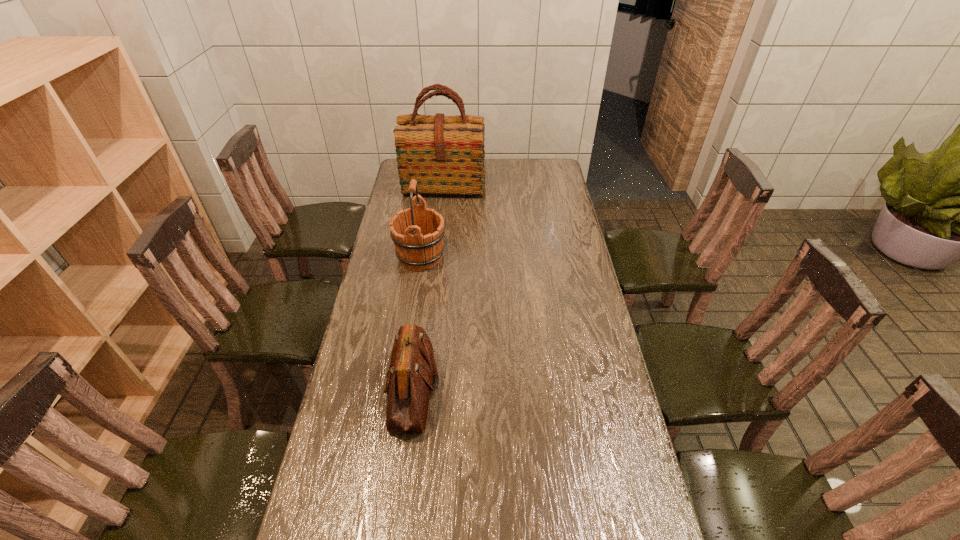
Where is `the farthest object`? the farthest object is located at coordinates (445, 154).

In order to click on the tallest object in this screenshot , I will do `click(445, 154)`.

Locate an element on the screen. the second tallest object is located at coordinates (417, 232).

Where is `the second farthest object`? the second farthest object is located at coordinates (417, 232).

Find the location of a particular element. The height and width of the screenshot is (540, 960). shoulder bag is located at coordinates (412, 368).

The image size is (960, 540). In order to click on the shortest object in this screenshot , I will do `click(412, 368)`.

Image resolution: width=960 pixels, height=540 pixels. Identify the location of vacant area situated on the open handle side of the farthest object. pos(439,233).

Where is `free space located 0.320m on the front of the wine bucket`? The image size is (960, 540). free space located 0.320m on the front of the wine bucket is located at coordinates (408, 343).

This screenshot has height=540, width=960. What are the coordinates of `vacant space located on the right of the shoulder bag` in the screenshot? It's located at (463, 389).

Find the location of `object located in the far edge section of the desktop`. object located in the far edge section of the desktop is located at coordinates (445, 154).